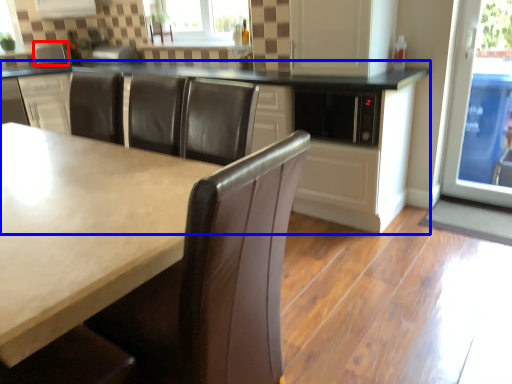
Question: Which point is further to the camera, appliance (highlighted by a red box) or cabinetry (highlighted by a blue box)?

Choices:
 (A) appliance
 (B) cabinetry

Answer: (A)